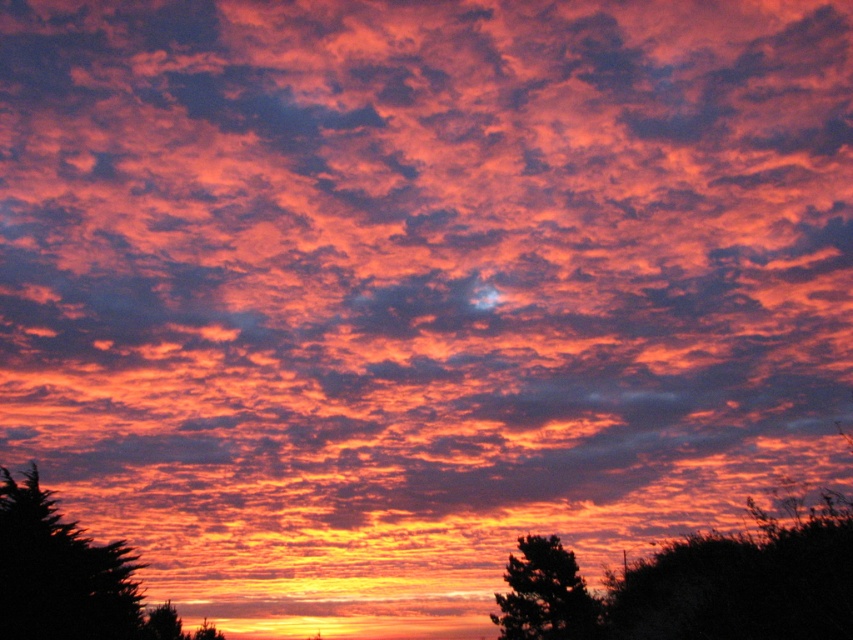
Question: Does dark green leafy tree at lower left appear on the right side of silhouette tree at lower right?

Choices:
 (A) yes
 (B) no

Answer: (B)

Question: Can you confirm if dark green leafy tree at lower left is positioned to the right of silhouette tree at lower right?

Choices:
 (A) yes
 (B) no

Answer: (B)

Question: Among these points, which one is nearest to the camera?

Choices:
 (A) (x=138, y=605)
 (B) (x=567, y=579)

Answer: (A)

Question: Among these points, which one is farthest from the camera?

Choices:
 (A) (540, 556)
 (B) (100, 572)

Answer: (A)

Question: In this image, where is dark green leafy tree at lower left located relative to silhouette tree at lower right?

Choices:
 (A) left
 (B) right

Answer: (A)